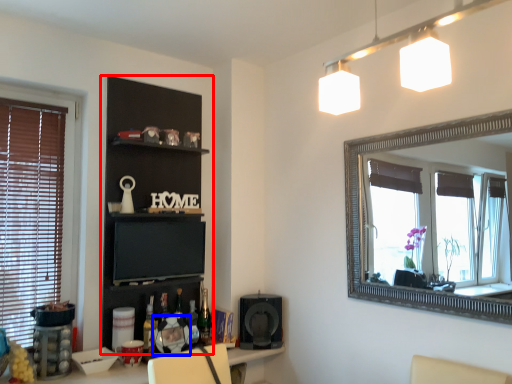
Question: Which object appears closest to the camera in this image, shelf (highlighted by a red box) or picture frame (highlighted by a blue box)?

Choices:
 (A) shelf
 (B) picture frame

Answer: (A)